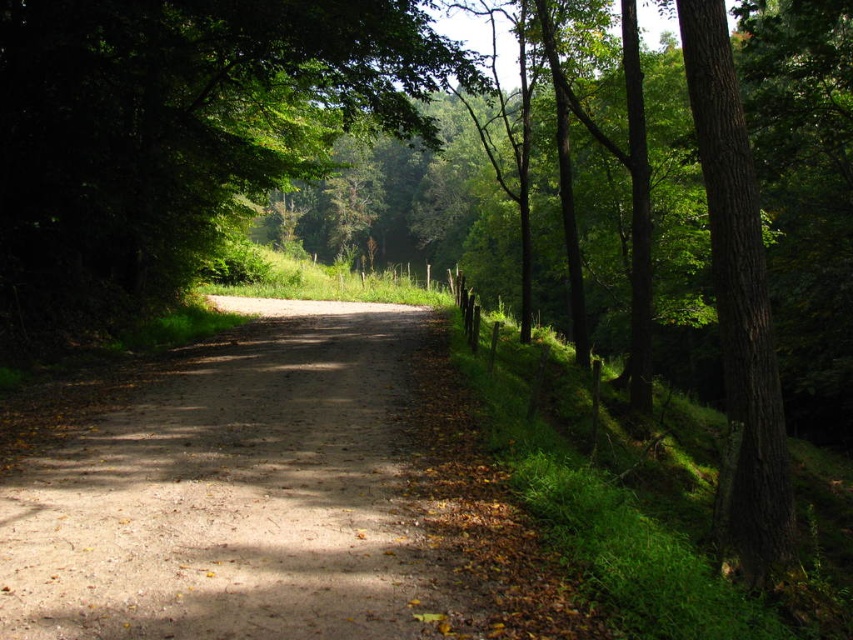
How far apart are dirt path at center and green rough bark tree at right?

dirt path at center is 20.22 feet from green rough bark tree at right.

You are a GUI agent. You are given a task and a screenshot of the screen. Output one action in this format:
    pyautogui.click(x=<x>, y=<y>)
    Task: Click on the dirt path at center
    
    Given the screenshot: What is the action you would take?
    pyautogui.click(x=233, y=496)

Is point (361, 468) positioned before point (689, 1)?

Yes, point (361, 468) is in front of point (689, 1).

The width and height of the screenshot is (853, 640). In order to click on dirt path at center in this screenshot , I will do `click(233, 496)`.

Based on the photo, is green leafy tree at center further to camera compared to green rough bark tree at right?

Yes, it is.

Who is higher up, green leafy tree at center or green rough bark tree at right?

green leafy tree at center is above.

At what (x,y) coordinates should I click in order to perform the action: click on green leafy tree at center. Please return your answer as a coordinate pair (x, y). The height and width of the screenshot is (640, 853). Looking at the image, I should click on (178, 134).

Where is `green leafy tree at center`? green leafy tree at center is located at coordinates (178, 134).

Where is `dirt path at center`? dirt path at center is located at coordinates (x=233, y=496).

Which is in front, point (274, 412) or point (242, 189)?

Positioned in front is point (274, 412).

Image resolution: width=853 pixels, height=640 pixels. I want to click on dirt path at center, so click(x=233, y=496).